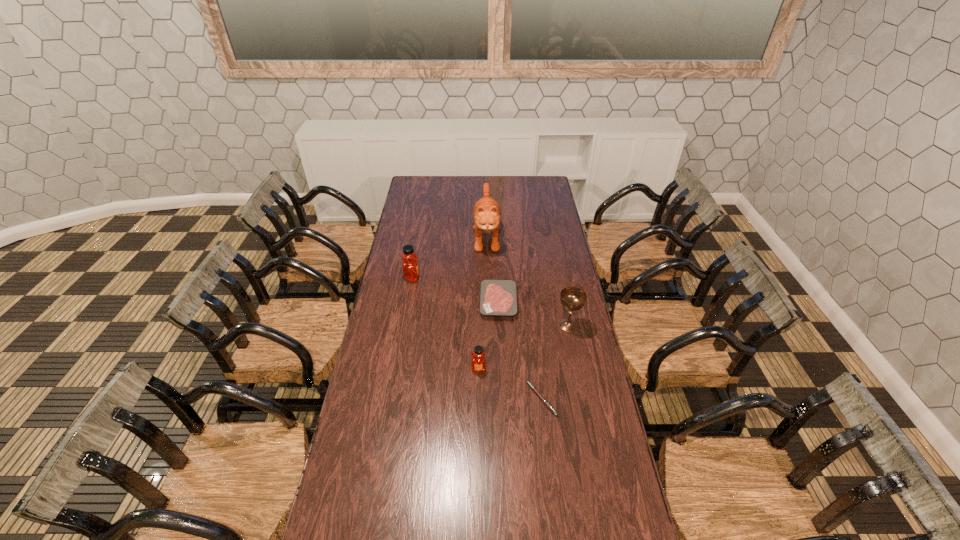
Find the location of a particular element. The width and height of the screenshot is (960, 540). vacant space that is in between the cat and the fifth tallest object is located at coordinates (492, 267).

Locate an element on the screen. free spot between the nearer honey and the fifth object from left to right is located at coordinates (510, 384).

Where is `vacant point located between the cat and the nearest object`? Image resolution: width=960 pixels, height=540 pixels. vacant point located between the cat and the nearest object is located at coordinates (515, 316).

The width and height of the screenshot is (960, 540). Find the location of `free area in between the steak and the tallest object`. free area in between the steak and the tallest object is located at coordinates (492, 267).

Where is `unoccupied area between the chalice and the farthest object`? The height and width of the screenshot is (540, 960). unoccupied area between the chalice and the farthest object is located at coordinates (527, 279).

The width and height of the screenshot is (960, 540). What are the coordinates of `object that stands as the closest to the shorter honey` in the screenshot? It's located at (533, 388).

Image resolution: width=960 pixels, height=540 pixels. In order to click on object that stands as the third closest to the right honey in this screenshot , I will do `click(572, 298)`.

The image size is (960, 540). I want to click on blank space that satisfies the following two spatial constraints: 1. on the face of the cat; 2. on the front label of the left honey, so click(x=488, y=278).